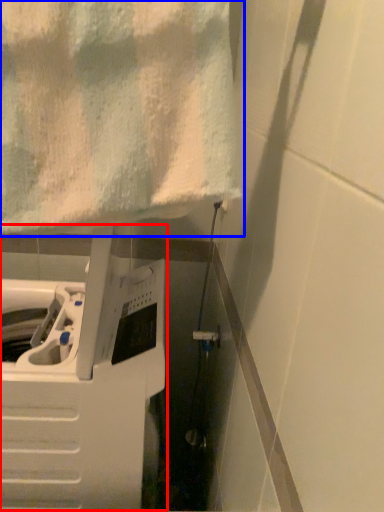
Question: Which point is further to the camera, appliance (highlighted by a red box) or towel (highlighted by a blue box)?

Choices:
 (A) appliance
 (B) towel

Answer: (A)